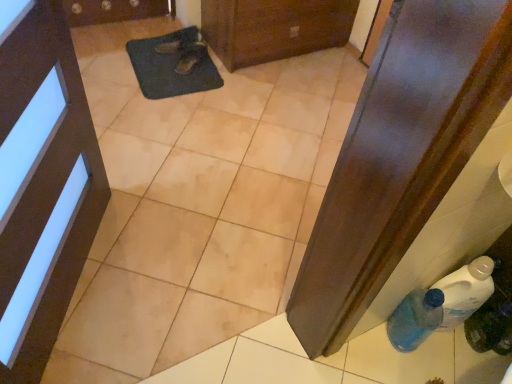
Locate an element on the screen. This screenshot has width=512, height=384. dark blue textured mat at center is located at coordinates (172, 65).

Where is `blue translucent bottle at lower right, positioned as the second bottle in left-to-right order`? This screenshot has width=512, height=384. blue translucent bottle at lower right, positioned as the second bottle in left-to-right order is located at coordinates (490, 328).

At what (x,y) coordinates should I click in order to perform the action: click on matte black door at upper left, arranged as the second door when viewed from the top. Please return your answer as a coordinate pair (x, y). This screenshot has height=384, width=512. Looking at the image, I should click on (42, 183).

Describe the element at coordinates (274, 28) in the screenshot. I see `brown wooden door at upper center, which is the 2th door in bottom-to-top order` at that location.

Describe the element at coordinates (185, 49) in the screenshot. Image resolution: width=512 pixels, height=384 pixels. I see `black leather shoe at upper center, which is counted as the first footwear, starting from the top` at that location.

This screenshot has width=512, height=384. I want to click on dark blue textured mat at center, so click(x=172, y=65).

From the picture: Is matte black door at upper left, arranged as the second door when viewed from the top, not near brown leather shoe at center, acting as the first footwear starting from the bottom?

Absolutely, matte black door at upper left, arranged as the second door when viewed from the top, is distant from brown leather shoe at center, acting as the first footwear starting from the bottom.

Is point (15, 36) closer or farther from the camera than point (194, 52)?

Point (15, 36) appears to be closer to the viewer than point (194, 52).

In order to click on the 2nd footwear positioned below the matte black door at upper left, which is the first door from bottom to top (from a real-world perspective) in this screenshot , I will do `click(190, 57)`.

Can you confirm if matte black door at upper left, arranged as the second door when viewed from the top, is bigger than brown leather shoe at center, the 2th footwear in the top-to-bottom sequence?

Correct, matte black door at upper left, arranged as the second door when viewed from the top, is larger in size than brown leather shoe at center, the 2th footwear in the top-to-bottom sequence.

Considering the points (285, 41) and (506, 349), which point is behind, point (285, 41) or point (506, 349)?

The point (285, 41) is more distant.

Considering the relative sizes of brown wooden door at upper center, which is the 2th door in bottom-to-top order, and blue translucent bottle at lower right, positioned as the second bottle in left-to-right order, in the image provided, is brown wooden door at upper center, which is the 2th door in bottom-to-top order, taller than blue translucent bottle at lower right, positioned as the second bottle in left-to-right order,?

Yes.

Between brown wooden door at upper center, placed as the 2th door when sorted from front to back, and blue translucent bottle at lower right, positioned as the second bottle in left-to-right order, which one has larger size?

Bigger between the two is brown wooden door at upper center, placed as the 2th door when sorted from front to back.

The image size is (512, 384). In order to click on door that appears behind the blue translucent bottle at lower right, which is the first bottle from right to left in this screenshot , I will do `click(274, 28)`.

Considering their positions, is blue translucent bottle at lower right, which ranks as the 1th bottle in left-to-right order, located in front of or behind black leather shoe at upper center, which is counted as the first footwear, starting from the top?

blue translucent bottle at lower right, which ranks as the 1th bottle in left-to-right order, is in front of black leather shoe at upper center, which is counted as the first footwear, starting from the top.

From the image's perspective, which is above, blue translucent bottle at lower right, the 2th bottle positioned from the right, or black leather shoe at upper center, which is counted as the first footwear, starting from the top?

black leather shoe at upper center, which is counted as the first footwear, starting from the top, appears higher in the image.

Consider the image. Is blue translucent bottle at lower right, the 2th bottle positioned from the right, to the left of black leather shoe at upper center, which is counted as the first footwear, starting from the top, from the viewer's perspective?

Incorrect, blue translucent bottle at lower right, the 2th bottle positioned from the right, is not on the left side of black leather shoe at upper center, which is counted as the first footwear, starting from the top.

From the picture: How different are the orientations of blue translucent bottle at lower right, which ranks as the 1th bottle in left-to-right order, and black leather shoe at upper center, positioned as the second footwear in bottom-to-top order, in degrees?

The facing directions of blue translucent bottle at lower right, which ranks as the 1th bottle in left-to-right order, and black leather shoe at upper center, positioned as the second footwear in bottom-to-top order, are 86.6 degrees apart.

Is black leather shoe at upper center, positioned as the second footwear in bottom-to-top order, taller or shorter than blue translucent bottle at lower right, which ranks as the 1th bottle in left-to-right order?

In the image, black leather shoe at upper center, positioned as the second footwear in bottom-to-top order, appears to be shorter than blue translucent bottle at lower right, which ranks as the 1th bottle in left-to-right order.

From a real-world perspective, which is physically above, black leather shoe at upper center, which is counted as the first footwear, starting from the top, or blue translucent bottle at lower right, the 2th bottle positioned from the right?

blue translucent bottle at lower right, the 2th bottle positioned from the right, from a real-world perspective.

Considering the relative sizes of black leather shoe at upper center, which is counted as the first footwear, starting from the top, and blue translucent bottle at lower right, the 2th bottle positioned from the right, in the image provided, is black leather shoe at upper center, which is counted as the first footwear, starting from the top, bigger than blue translucent bottle at lower right, the 2th bottle positioned from the right,?

Incorrect, black leather shoe at upper center, which is counted as the first footwear, starting from the top, is not larger than blue translucent bottle at lower right, the 2th bottle positioned from the right.

Which of these two, black leather shoe at upper center, positioned as the second footwear in bottom-to-top order, or blue translucent bottle at lower right, the 2th bottle positioned from the right, is wider?

black leather shoe at upper center, positioned as the second footwear in bottom-to-top order.

Are black leather shoe at upper center, positioned as the second footwear in bottom-to-top order, and brown leather shoe at center, acting as the first footwear starting from the bottom, beside each other?

Yes, black leather shoe at upper center, positioned as the second footwear in bottom-to-top order, is touching brown leather shoe at center, acting as the first footwear starting from the bottom.

Who is more distant, black leather shoe at upper center, positioned as the second footwear in bottom-to-top order, or brown leather shoe at center, acting as the first footwear starting from the bottom?

black leather shoe at upper center, positioned as the second footwear in bottom-to-top order, is further from the camera.

From a real-world perspective, between black leather shoe at upper center, positioned as the second footwear in bottom-to-top order, and brown leather shoe at center, the 2th footwear in the top-to-bottom sequence, who is vertically lower?

brown leather shoe at center, the 2th footwear in the top-to-bottom sequence, from a real-world perspective.

From the picture: Is black leather shoe at upper center, which is counted as the first footwear, starting from the top, wider or thinner than brown leather shoe at center, acting as the first footwear starting from the bottom?

In the image, black leather shoe at upper center, which is counted as the first footwear, starting from the top, appears to be more narrow than brown leather shoe at center, acting as the first footwear starting from the bottom.

Is matte black door at upper left, positioned as the second door in right-to-left order, oriented away from blue translucent bottle at lower right, which ranks as the 1th bottle in left-to-right order?

No, blue translucent bottle at lower right, which ranks as the 1th bottle in left-to-right order, is not at the back of matte black door at upper left, positioned as the second door in right-to-left order.

Can you confirm if matte black door at upper left, which appears as the first door when viewed from the front, is positioned to the right of blue translucent bottle at lower right, the 2th bottle positioned from the right?

Incorrect, matte black door at upper left, which appears as the first door when viewed from the front, is not on the right side of blue translucent bottle at lower right, the 2th bottle positioned from the right.

From the image's perspective, between matte black door at upper left, positioned as the second door in right-to-left order, and blue translucent bottle at lower right, which ranks as the 1th bottle in left-to-right order, which one is located above?

From the image's view, matte black door at upper left, positioned as the second door in right-to-left order, is above.

From a real-world perspective, between matte black door at upper left, positioned as the second door in right-to-left order, and blue translucent bottle at lower right, the 2th bottle positioned from the right, who is vertically lower?

From a 3D spatial view, blue translucent bottle at lower right, the 2th bottle positioned from the right, is below.

From a real-world perspective, which object stands above the other?

brown wooden door at upper center, which ranks as the 1th door in top-to-bottom order, is physically above.

How distant is brown wooden door at upper center, which is the 2th door in bottom-to-top order, from black leather shoe at upper center, positioned as the second footwear in bottom-to-top order?

brown wooden door at upper center, which is the 2th door in bottom-to-top order, is 13.88 inches away from black leather shoe at upper center, positioned as the second footwear in bottom-to-top order.

In the image, is brown wooden door at upper center, which is the 2th door in bottom-to-top order, positioned in front of or behind black leather shoe at upper center, which is counted as the first footwear, starting from the top?

Visually, brown wooden door at upper center, which is the 2th door in bottom-to-top order, is located in front of black leather shoe at upper center, which is counted as the first footwear, starting from the top.

Would you say brown wooden door at upper center, which is the 1th door from back to front, is a long distance from black leather shoe at upper center, which is counted as the first footwear, starting from the top?

brown wooden door at upper center, which is the 1th door from back to front, is near black leather shoe at upper center, which is counted as the first footwear, starting from the top, not far away.

Image resolution: width=512 pixels, height=384 pixels. I want to click on door below the brown leather shoe at center, acting as the first footwear starting from the bottom (from the image's perspective), so click(42, 183).

Identify the location of door that is the 2nd one when counting upward from the blue translucent bottle at lower right, which is the first bottle from right to left (from the image's perspective). (274, 28).

From the picture: Looking at the image, which one is located closer to black leather shoe at upper center, which is counted as the first footwear, starting from the top, matte black door at upper left, marked as the 2th door in a back-to-front arrangement, or blue translucent bottle at lower right, which ranks as the 1th bottle in left-to-right order?

Among the two, matte black door at upper left, marked as the 2th door in a back-to-front arrangement, is located nearer to black leather shoe at upper center, which is counted as the first footwear, starting from the top.

When comparing their distances from blue translucent bottle at lower right, which is the first bottle from right to left, does black leather shoe at upper center, which is counted as the first footwear, starting from the top, or dark blue textured mat at center seem further?

black leather shoe at upper center, which is counted as the first footwear, starting from the top, is positioned further to the anchor blue translucent bottle at lower right, which is the first bottle from right to left.

Which object lies nearer to the anchor point brown wooden door at upper center, which is the 2th door in bottom-to-top order, matte black door at upper left, marked as the 1th door in a left-to-right arrangement, or dark blue textured mat at center?

dark blue textured mat at center.

Looking at the image, which one is located closer to blue translucent bottle at lower right, the 2th bottle positioned from the right, brown leather shoe at center, acting as the first footwear starting from the bottom, or black leather shoe at upper center, positioned as the second footwear in bottom-to-top order?

brown leather shoe at center, acting as the first footwear starting from the bottom, lies closer to blue translucent bottle at lower right, the 2th bottle positioned from the right, than the other object.

From the image, which object appears to be nearer to matte black door at upper left, marked as the 2th door in a back-to-front arrangement, black leather shoe at upper center, positioned as the second footwear in bottom-to-top order, or dark blue textured mat at center?

Among the two, dark blue textured mat at center is located nearer to matte black door at upper left, marked as the 2th door in a back-to-front arrangement.

Which object lies further to the anchor point brown leather shoe at center, the 2th footwear in the top-to-bottom sequence, brown wooden door at upper center, which is counted as the 1th door, starting from the right, or blue translucent bottle at lower right, positioned as the second bottle in left-to-right order?

blue translucent bottle at lower right, positioned as the second bottle in left-to-right order.

Considering their positions, is blue translucent bottle at lower right, which is the first bottle from right to left, positioned further to matte black door at upper left, arranged as the second door when viewed from the top, than black leather shoe at upper center, positioned as the second footwear in bottom-to-top order?

blue translucent bottle at lower right, which is the first bottle from right to left.

Which object lies nearer to the anchor point blue translucent bottle at lower right, which is the first bottle from right to left, brown leather shoe at center, the 2th footwear in the top-to-bottom sequence, or brown wooden door at upper center, which ranks as the 1th door in top-to-bottom order?

The object closer to blue translucent bottle at lower right, which is the first bottle from right to left, is brown wooden door at upper center, which ranks as the 1th door in top-to-bottom order.

In order to click on bottle between brown leather shoe at center, the 2th footwear in the top-to-bottom sequence, and blue translucent bottle at lower right, positioned as the second bottle in left-to-right order, in the up-down direction in this screenshot , I will do `click(415, 319)`.

You are a GUI agent. You are given a task and a screenshot of the screen. Output one action in this format:
    pyautogui.click(x=<x>, y=<y>)
    Task: Click on the bottle between black leather shoe at upper center, which is counted as the first footwear, starting from the top, and blue translucent bottle at lower right, positioned as the second bottle in left-to-right order, from top to bottom
    Image resolution: width=512 pixels, height=384 pixels.
    Given the screenshot: What is the action you would take?
    pyautogui.click(x=415, y=319)

At what (x,y) coordinates should I click in order to perform the action: click on mat between brown wooden door at upper center, placed as the 2th door when sorted from front to back, and blue translucent bottle at lower right, which is the first bottle from right to left, in the up-down direction. Please return your answer as a coordinate pair (x, y). The height and width of the screenshot is (384, 512). Looking at the image, I should click on (172, 65).

Identify the location of door between matte black door at upper left, arranged as the second door when viewed from the top, and brown leather shoe at center, the 2th footwear in the top-to-bottom sequence, along the z-axis. This screenshot has height=384, width=512. (274, 28).